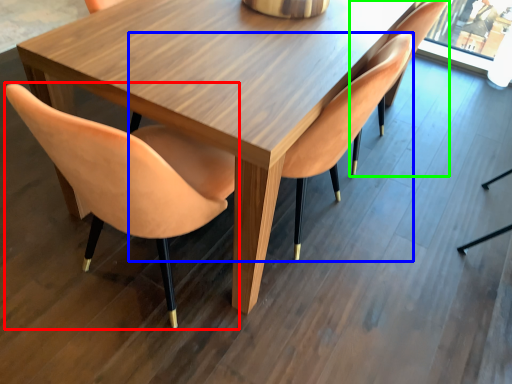
Question: Estimate the real-world distances between objects in this image. Which object is closer to chair (highlighted by a red box), chair (highlighted by a blue box) or chair (highlighted by a green box)?

Choices:
 (A) chair
 (B) chair

Answer: (A)